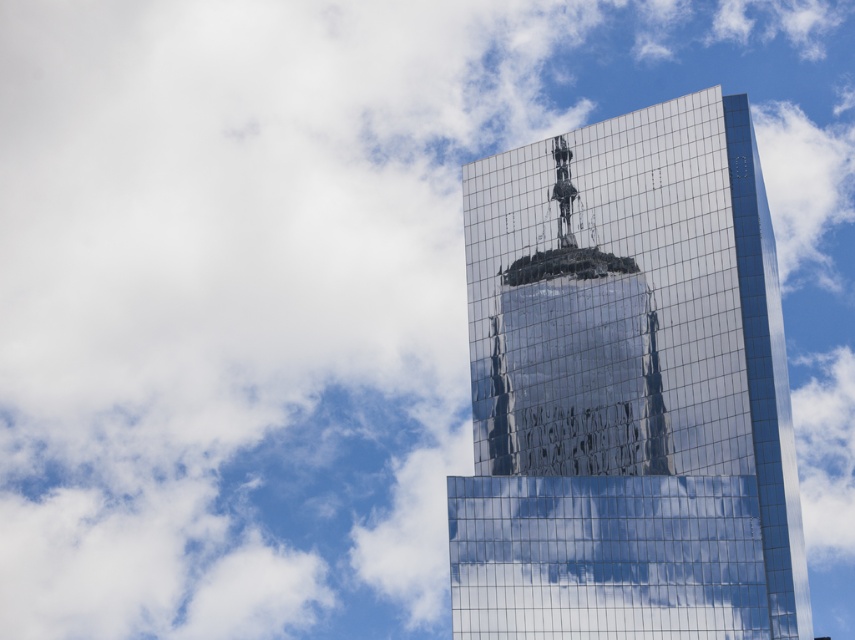
Question: Among these objects, which one is farthest from the camera?

Choices:
 (A) reflective glass tower at center
 (B) glossy glass skyscraper at center

Answer: (B)

Question: Which point is farther to the camera?

Choices:
 (A) glossy glass skyscraper at center
 (B) reflective glass tower at center

Answer: (A)

Question: In this image, where is reflective glass tower at center located relative to glossy glass skyscraper at center?

Choices:
 (A) left
 (B) right

Answer: (B)

Question: Is reflective glass tower at center to the left of glossy glass skyscraper at center from the viewer's perspective?

Choices:
 (A) yes
 (B) no

Answer: (B)

Question: Is reflective glass tower at center in front of glossy glass skyscraper at center?

Choices:
 (A) no
 (B) yes

Answer: (B)

Question: Among these objects, which one is nearest to the camera?

Choices:
 (A) glossy glass skyscraper at center
 (B) reflective glass tower at center

Answer: (B)